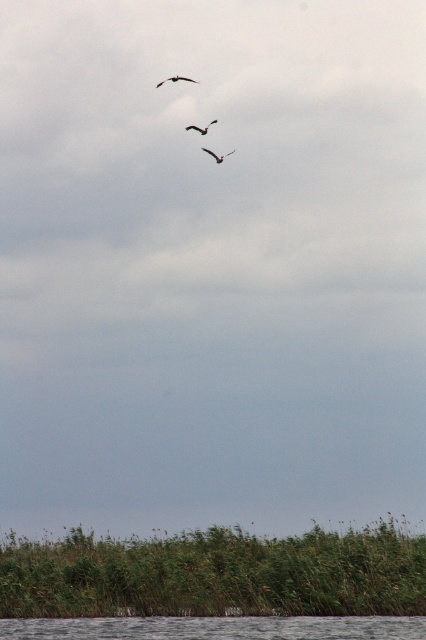
From the picture: You are a photographer trying to capture a wide shot of the scene. You need to ensure both the gray smooth water at lower center and the dark brown feathered bird at upper center are clearly visible. Given their sizes, which object might require you to adjust your camera settings to avoid being too small in the frame?

The dark brown feathered bird at upper center might require adjusting camera settings because the gray smooth water at lower center is wider than it, making the bird potentially appear smaller in the frame.

You are an ornithologist observing birds in the sky. You notice a dark gray feathered bird at upper center. Can you determine its exact position relative to the other birds?

The dark gray feathered bird at upper center is located at point (176,80), which is the exact position of the bird in the scene.

Consider the image. You are an ornithologist observing two birds in flight against the cloudy sky. You notice a dark gray feathered bird at upper center and a dark brown feathered bird at upper center. Which of these two birds has a greater wingspan?

The dark gray feathered bird at upper center has a greater wingspan than the dark brown feathered bird at upper center because its width is larger.